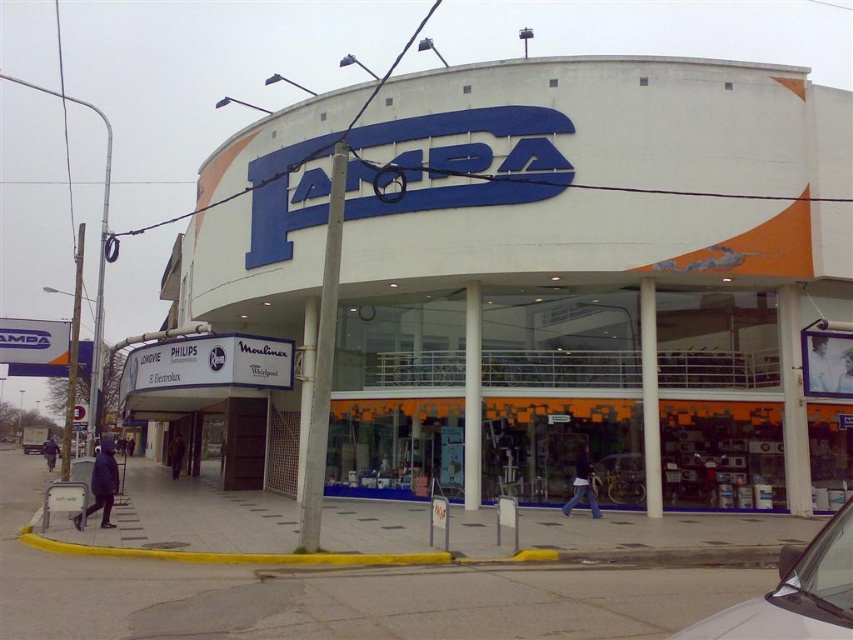
Is point (372, 134) positioned before point (804, 608)?

No.

Locate an element on the screen. white glossy building at center is located at coordinates (595, 282).

The width and height of the screenshot is (853, 640). Identify the location of white glossy building at center. (595, 282).